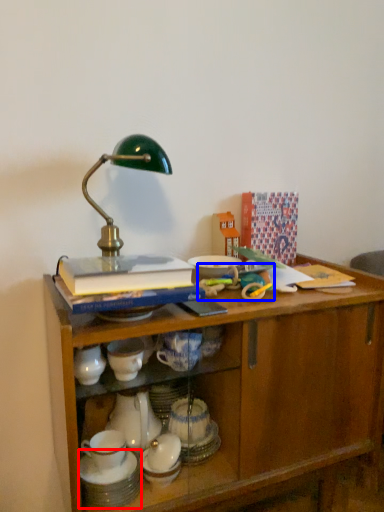
Question: Which of the following is the closest to the observer, tableware (highlighted by a red box) or toy (highlighted by a blue box)?

Choices:
 (A) tableware
 (B) toy

Answer: (A)